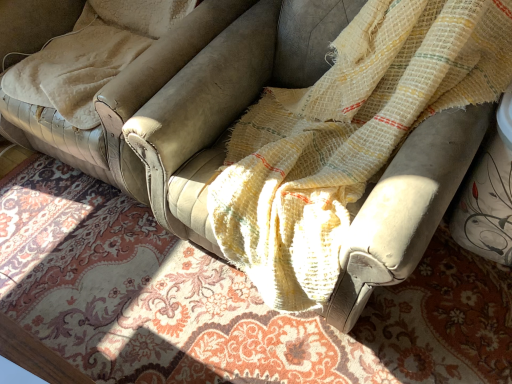
Identify the location of woven fabric blanket at center. This screenshot has height=384, width=512. (224, 301).

What is the approximate width of woven fabric blanket at center?

It is 1.77 meters.

This screenshot has height=384, width=512. Describe the element at coordinates (224, 301) in the screenshot. I see `woven fabric blanket at center` at that location.

Image resolution: width=512 pixels, height=384 pixels. I want to click on woven fabric blanket at center, so click(224, 301).